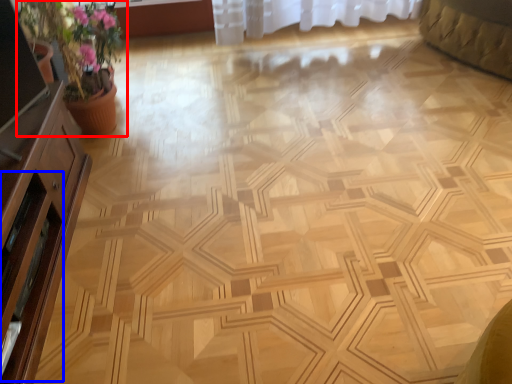
Question: Which point is closer to the camera, houseplant (highlighted by a red box) or screen door (highlighted by a blue box)?

Choices:
 (A) houseplant
 (B) screen door

Answer: (B)